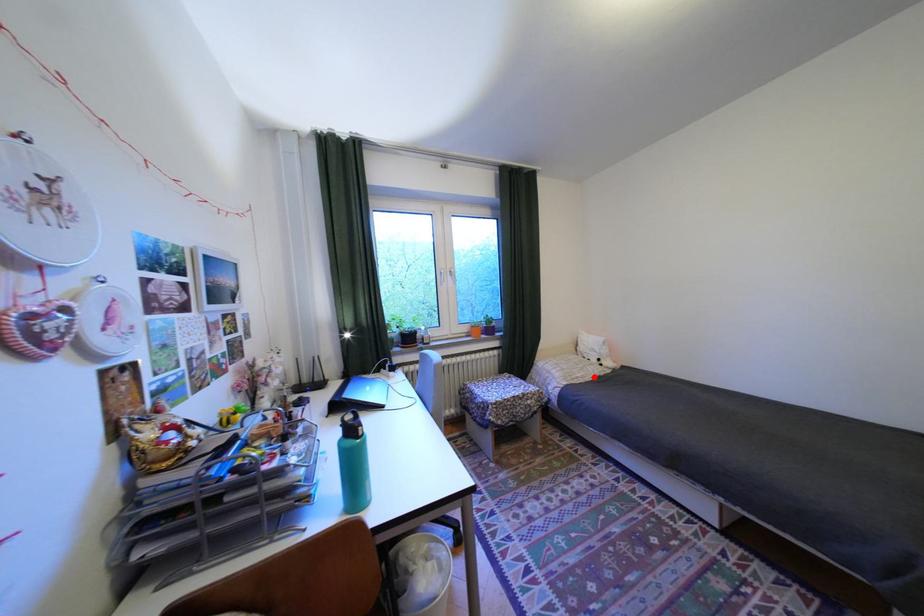
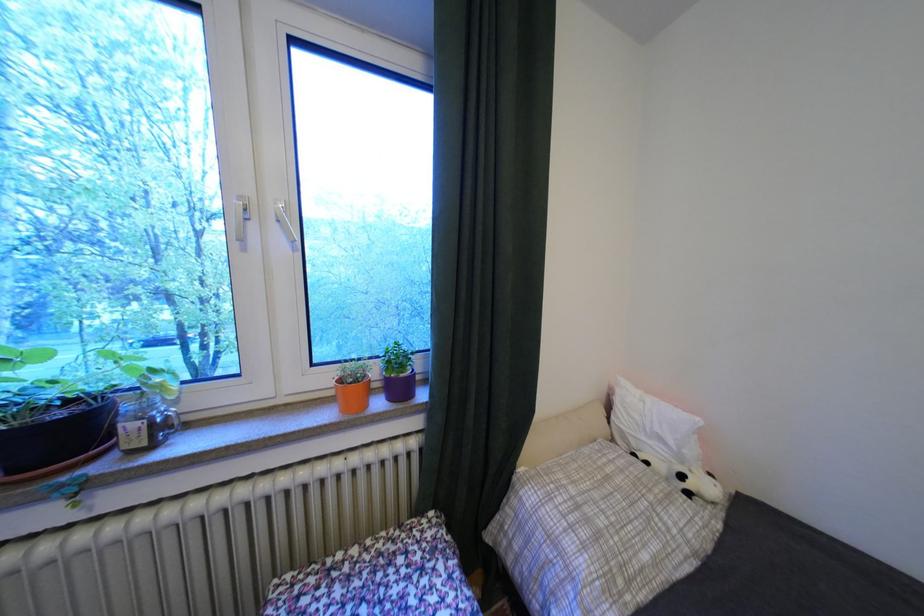
Question: I am providing you with two images of the same scene from different viewpoints. In image1, a red point is highlighted. Considering the same 3D point in image2, which of the following is correct?

Choices:
 (A) It is closer
 (B) It is farther

Answer: (A)